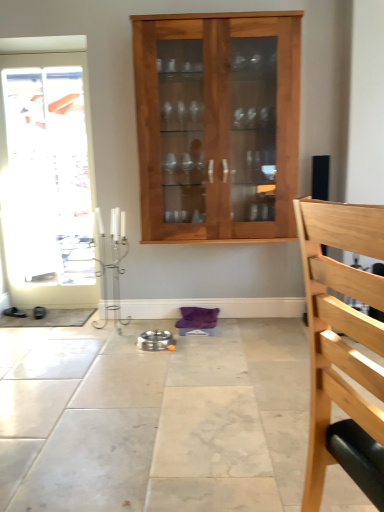
This screenshot has width=384, height=512. Identify the location of light brown wood cabinet at center. (213, 122).

Between point (215, 84) and point (85, 126), which one is positioned behind?

The point (85, 126) is behind.

Based on their sizes in the image, would you say light brown wood cabinet at center is bigger or smaller than white glossy door at left?

Considering their sizes, light brown wood cabinet at center takes up more space than white glossy door at left.

Is light brown wood cabinet at center oriented towards white glossy door at left?

No, light brown wood cabinet at center is not oriented towards white glossy door at left.

Is black leather shoes at lower left closer to the viewer compared to white glossy door at left?

No, black leather shoes at lower left is further to the viewer.

In terms of size, does black leather shoes at lower left appear bigger or smaller than white glossy door at left?

Clearly, black leather shoes at lower left is smaller in size than white glossy door at left.

You are a GUI agent. You are given a task and a screenshot of the screen. Output one action in this format:
    pyautogui.click(x=<x>, y=<y>)
    Task: Click on the door in front of the black leather shoes at lower left
    The image size is (384, 512).
    Given the screenshot: What is the action you would take?
    pyautogui.click(x=45, y=172)

From a real-world perspective, is black leather shoes at lower left physically located above or below white glossy door at left?

black leather shoes at lower left is below white glossy door at left.

Is light wood chair at right inside black leather shoes at lower left?

Actually, light wood chair at right is outside black leather shoes at lower left.

Considering the relative positions of black leather shoes at lower left and light wood chair at right in the image provided, is black leather shoes at lower left to the right of light wood chair at right from the viewer's perspective?

No.

What's the angular difference between black leather shoes at lower left and light wood chair at right's facing directions?

black leather shoes at lower left and light wood chair at right are facing 132 degrees away from each other.

Is black leather shoes at lower left placed right next to light wood chair at right?

black leather shoes at lower left and light wood chair at right are clearly separated.

Is black leather shoes at lower left inside light wood chair at right?

No, black leather shoes at lower left is not a part of light wood chair at right.

Is light wood chair at right touching black leather shoes at lower left?

No, light wood chair at right is not next to black leather shoes at lower left.

From a real-world perspective, between light wood chair at right and black leather shoes at lower left, who is vertically higher?

In real-world perspective, light wood chair at right is above.

Is point (47, 56) in front of point (23, 315)?

Yes, it is.

Between white glossy door at left and black leather shoes at lower left, which one has larger size?

white glossy door at left is bigger.

Is the surface of white glossy door at left in direct contact with black leather shoes at lower left?

No, white glossy door at left is not in contact with black leather shoes at lower left.

Between white glossy door at left and black leather shoes at lower left, which one has larger width?

With larger width is black leather shoes at lower left.

Is white glossy door at left turned away from light wood chair at right?

No, white glossy door at left is not facing the opposite direction of light wood chair at right.

Looking at the image, does white glossy door at left seem bigger or smaller compared to light wood chair at right?

white glossy door at left is bigger than light wood chair at right.

How far apart are white glossy door at left and light wood chair at right?

white glossy door at left and light wood chair at right are 3.08 meters apart from each other.

Consider the image. Does white glossy door at left have a greater width compared to light wood chair at right?

Incorrect, the width of white glossy door at left does not surpass that of light wood chair at right.

Is light brown wood cabinet at center completely or partially outside of black leather shoes at lower left?

Yes, light brown wood cabinet at center is located beyond the bounds of black leather shoes at lower left.

Looking at this image, between light brown wood cabinet at center and black leather shoes at lower left, which one has smaller size?

black leather shoes at lower left is smaller.

Considering the points (227, 74) and (15, 310), which point is behind, point (227, 74) or point (15, 310)?

The point (15, 310) is farther.

Is light brown wood cabinet at center not near black leather shoes at lower left?

light brown wood cabinet at center is positioned a significant distance from black leather shoes at lower left.

Locate an element on the screen. This screenshot has height=512, width=384. cabinetry lying on the right of white glossy door at left is located at coordinates (x=213, y=122).

Find the location of a particular element. The image size is (384, 512). door lying above the black leather shoes at lower left (from the image's perspective) is located at coordinates (45, 172).

In the scene shown: Considering their positions, is light brown wood cabinet at center positioned further to white glossy door at left than light wood chair at right?

The object further to white glossy door at left is light wood chair at right.

Estimate the real-world distances between objects in this image. Which object is closer to black leather shoes at lower left, light wood chair at right or white glossy door at left?

The object closer to black leather shoes at lower left is white glossy door at left.

Which object lies nearer to the anchor point black leather shoes at lower left, light brown wood cabinet at center or white glossy door at left?

Among the two, white glossy door at left is located nearer to black leather shoes at lower left.

When comparing their distances from black leather shoes at lower left, does light brown wood cabinet at center or light wood chair at right seem closer?

light brown wood cabinet at center lies closer to black leather shoes at lower left than the other object.

From the image, which object appears to be nearer to light wood chair at right, white glossy door at left or light brown wood cabinet at center?

light brown wood cabinet at center.

Considering their positions, is light brown wood cabinet at center positioned further to white glossy door at left than black leather shoes at lower left?

Among the two, light brown wood cabinet at center is located further to white glossy door at left.

In the scene shown: When comparing their distances from white glossy door at left, does black leather shoes at lower left or light brown wood cabinet at center seem closer?

The object closer to white glossy door at left is black leather shoes at lower left.

Which object lies further to the anchor point light brown wood cabinet at center, black leather shoes at lower left or light wood chair at right?

black leather shoes at lower left is positioned further to the anchor light brown wood cabinet at center.

In order to click on cabinetry located between light wood chair at right and black leather shoes at lower left in the depth direction in this screenshot , I will do `click(213, 122)`.

Find the location of `door between black leather shoes at lower left and light brown wood cabinet at center`. door between black leather shoes at lower left and light brown wood cabinet at center is located at coordinates (45, 172).

The height and width of the screenshot is (512, 384). In order to click on door between light wood chair at right and black leather shoes at lower left in the front-back direction in this screenshot , I will do `click(45, 172)`.

This screenshot has height=512, width=384. In order to click on cabinetry located between light wood chair at right and white glossy door at left in the depth direction in this screenshot , I will do `click(213, 122)`.